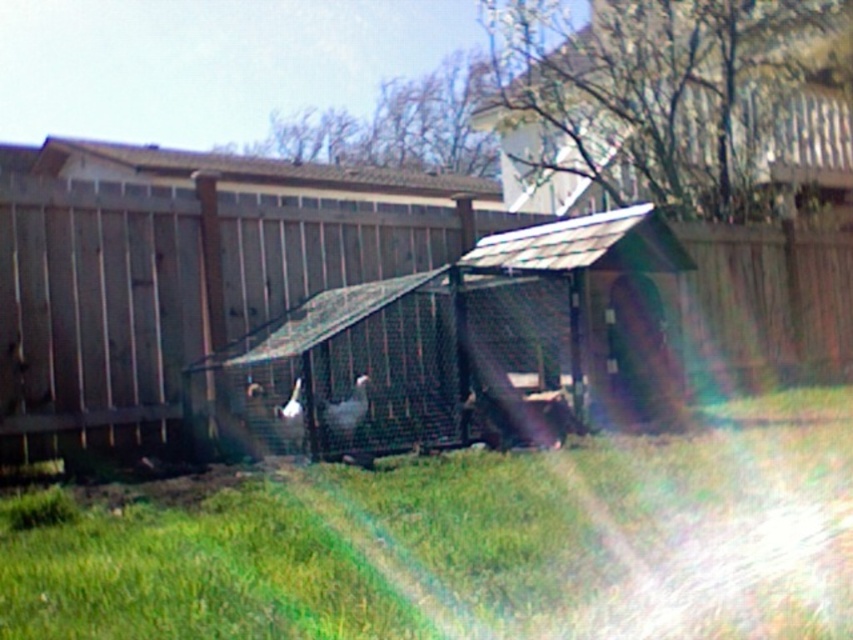
Does green grass at center have a lesser height compared to metallic gray hut at center?

Yes.

Looking at this image, measure the distance from green grass at center to metallic gray hut at center.

12.33 meters

You are a GUI agent. You are given a task and a screenshot of the screen. Output one action in this format:
    pyautogui.click(x=<x>, y=<y>)
    Task: Click on the green grass at center
    Image resolution: width=853 pixels, height=640 pixels.
    Given the screenshot: What is the action you would take?
    pyautogui.click(x=479, y=544)

Is point (790, 300) positioned in front of point (76, 444)?

No, (790, 300) is further to viewer.

Between metallic gray hut at center and wooden chicken coop at center, which one has more height?

Standing taller between the two is metallic gray hut at center.

Is point (825, 234) in front of point (271, 192)?

Yes, point (825, 234) is closer to viewer.

I want to click on metallic gray hut at center, so click(x=700, y=161).

Looking at this image, between green grass at center and wooden chicken coop at center, which one appears on the left side from the viewer's perspective?

wooden chicken coop at center

This screenshot has height=640, width=853. What do you see at coordinates (479, 544) in the screenshot? I see `green grass at center` at bounding box center [479, 544].

Find the location of a particular element. This screenshot has width=853, height=640. green grass at center is located at coordinates (479, 544).